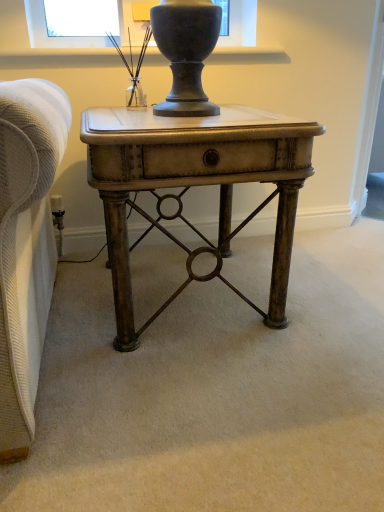
Question: From the image's perspective, is matte black table lamp at upper center located above antique brass desk at center?

Choices:
 (A) yes
 (B) no

Answer: (A)

Question: Considering the relative sizes of matte black table lamp at upper center and antique brass desk at center in the image provided, is matte black table lamp at upper center taller than antique brass desk at center?

Choices:
 (A) no
 (B) yes

Answer: (A)

Question: Is matte black table lamp at upper center facing away from antique brass desk at center?

Choices:
 (A) yes
 (B) no

Answer: (B)

Question: Is matte black table lamp at upper center positioned beyond the bounds of antique brass desk at center?

Choices:
 (A) no
 (B) yes

Answer: (B)

Question: From a real-world perspective, is matte black table lamp at upper center over antique brass desk at center?

Choices:
 (A) yes
 (B) no

Answer: (A)

Question: Is antique brass desk at center completely or partially inside matte black table lamp at upper center?

Choices:
 (A) yes
 (B) no

Answer: (B)

Question: Is antique brass desk at center completely or partially outside of matte black table lamp at upper center?

Choices:
 (A) yes
 (B) no

Answer: (A)

Question: Can you confirm if antique brass desk at center is shorter than matte black table lamp at upper center?

Choices:
 (A) yes
 (B) no

Answer: (B)

Question: Is antique brass desk at center in front of matte black table lamp at upper center?

Choices:
 (A) yes
 (B) no

Answer: (A)

Question: From a real-world perspective, is antique brass desk at center on top of matte black table lamp at upper center?

Choices:
 (A) yes
 (B) no

Answer: (B)

Question: From a real-world perspective, is antique brass desk at center under matte black table lamp at upper center?

Choices:
 (A) yes
 (B) no

Answer: (A)

Question: Can you confirm if antique brass desk at center is bigger than matte black table lamp at upper center?

Choices:
 (A) no
 (B) yes

Answer: (B)

Question: Considering their positions, is matte black table lamp at upper center located in front of or behind antique brass desk at center?

Choices:
 (A) front
 (B) behind

Answer: (B)